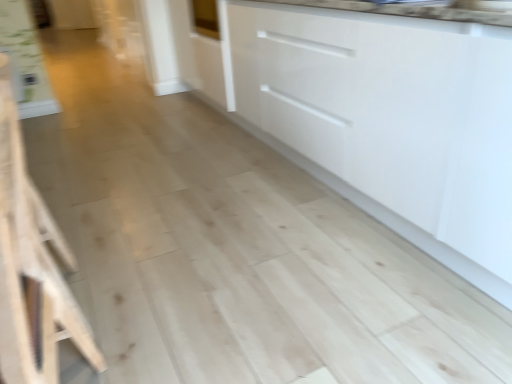
This screenshot has width=512, height=384. What do you see at coordinates (32, 267) in the screenshot?
I see `light wood stool at left` at bounding box center [32, 267].

This screenshot has height=384, width=512. What are the coordinates of `light wood stool at left` in the screenshot? It's located at (32, 267).

Identify the location of white glossy cabinet at center. tap(392, 121).

In order to face white glossy cabinet at center, should I rotate leftwards or rightwards?

Turn right by 15.155 degrees to look at white glossy cabinet at center.

Measure the distance between white glossy cabinet at center and camera.

3.58 feet.

What do you see at coordinates (392, 121) in the screenshot? I see `white glossy cabinet at center` at bounding box center [392, 121].

At what (x,y) coordinates should I click in order to perform the action: click on light wood stool at left. Please return your answer as a coordinate pair (x, y). Looking at the image, I should click on (32, 267).

Would you say white glossy cabinet at center is to the left or to the right of light wood stool at left in the picture?

From the image, it's evident that white glossy cabinet at center is to the right of light wood stool at left.

Considering the relative positions of white glossy cabinet at center and light wood stool at left in the image provided, is white glossy cabinet at center behind light wood stool at left?

Yes, white glossy cabinet at center is further from the viewer.

Between point (462, 200) and point (27, 219), which one is positioned in front?

The point (27, 219) is in front.

From the image's perspective, between white glossy cabinet at center and light wood stool at left, which one is located above?

white glossy cabinet at center, from the image's perspective.

Consider the image. From a real-world perspective, which is physically above, white glossy cabinet at center or light wood stool at left?

From a 3D spatial view, white glossy cabinet at center is above.

Which of these two, white glossy cabinet at center or light wood stool at left, is thinner?

light wood stool at left.

Considering the sizes of white glossy cabinet at center and light wood stool at left in the image, is white glossy cabinet at center taller or shorter than light wood stool at left?

Clearly, white glossy cabinet at center is taller compared to light wood stool at left.

Considering the sizes of white glossy cabinet at center and light wood stool at left in the image, is white glossy cabinet at center bigger or smaller than light wood stool at left?

Clearly, white glossy cabinet at center is larger in size than light wood stool at left.

Could light wood stool at left be considered to be inside white glossy cabinet at center?

No, light wood stool at left is not inside white glossy cabinet at center.

Are white glossy cabinet at center and light wood stool at left located far from each other?

That's right, there is a large distance between white glossy cabinet at center and light wood stool at left.

Is white glossy cabinet at center positioned with its back to light wood stool at left?

No, white glossy cabinet at center's orientation is not away from light wood stool at left.

How many degrees apart are the facing directions of white glossy cabinet at center and light wood stool at left?

The angle between the facing direction of white glossy cabinet at center and the facing direction of light wood stool at left is 1.24 degrees.

Based on the photo, how far apart are white glossy cabinet at center and light wood stool at left?

white glossy cabinet at center is 1.22 meters from light wood stool at left.

The width and height of the screenshot is (512, 384). Find the location of `furniture in front of the white glossy cabinet at center`. furniture in front of the white glossy cabinet at center is located at coordinates (32, 267).

Which is more to the left, light wood stool at left or white glossy cabinet at center?

light wood stool at left is more to the left.

Looking at this image, is light wood stool at left in front of white glossy cabinet at center?

That is True.

Which point is more distant from viewer, [37,268] or [355,141]?

The point [355,141] is farther from the camera.

From the image's perspective, does light wood stool at left appear lower than white glossy cabinet at center?

Yes, from the image's perspective, light wood stool at left is below white glossy cabinet at center.

From a real-world perspective, which object rests below the other?

From a 3D spatial view, light wood stool at left is below.

Looking at their sizes, would you say light wood stool at left is wider or thinner than white glossy cabinet at center?

light wood stool at left is thinner than white glossy cabinet at center.

From their relative heights in the image, would you say light wood stool at left is taller or shorter than white glossy cabinet at center?

In the image, light wood stool at left appears to be shorter than white glossy cabinet at center.

Is light wood stool at left bigger or smaller than white glossy cabinet at center?

light wood stool at left is smaller than white glossy cabinet at center.

From the picture: Can we say light wood stool at left lies outside white glossy cabinet at center?

Yes, light wood stool at left is outside of white glossy cabinet at center.

Would you consider light wood stool at left to be distant from white glossy cabinet at center?

light wood stool at left is positioned a significant distance from white glossy cabinet at center.

Is light wood stool at left positioned with its back to white glossy cabinet at center?

Yes.

Identify the location of cabinetry above the light wood stool at left (from a real-world perspective). The width and height of the screenshot is (512, 384). (392, 121).

In order to click on cabinetry above the light wood stool at left (from a real-world perspective) in this screenshot , I will do `click(392, 121)`.

Identify the location of cabinetry that is on the right side of light wood stool at left. The height and width of the screenshot is (384, 512). (392, 121).